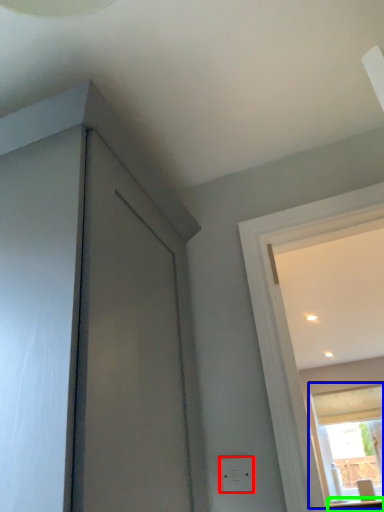
Question: Considering the real-world distances, which object is closest to electric outlet (highlighted by a red box)? window (highlighted by a blue box) or counter top (highlighted by a green box).

Choices:
 (A) window
 (B) counter top

Answer: (B)